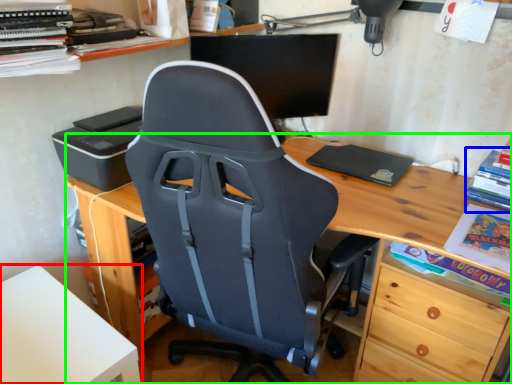
Question: Estimate the real-world distances between objects in this image. Which object is farther from table (highlighted by a red box), book (highlighted by a blue box) or desk (highlighted by a green box)?

Choices:
 (A) book
 (B) desk

Answer: (A)